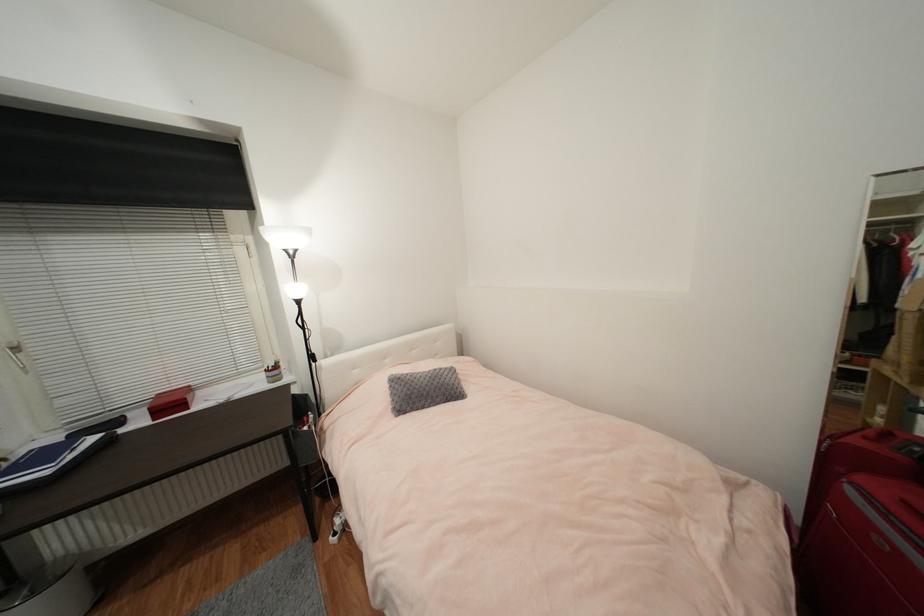
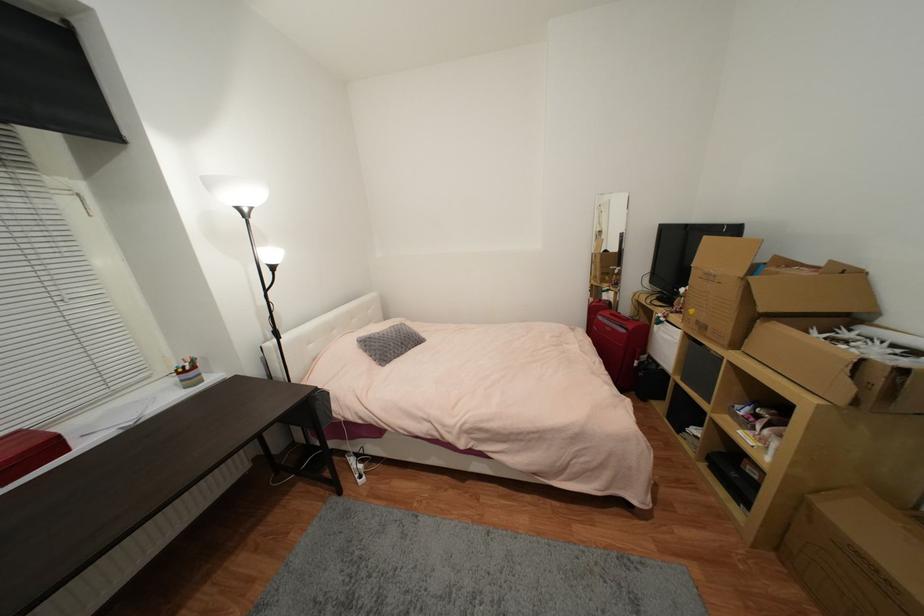
The point at (398, 375) is marked in the first image. Where is the corresponding point in the second image?

(365, 338)